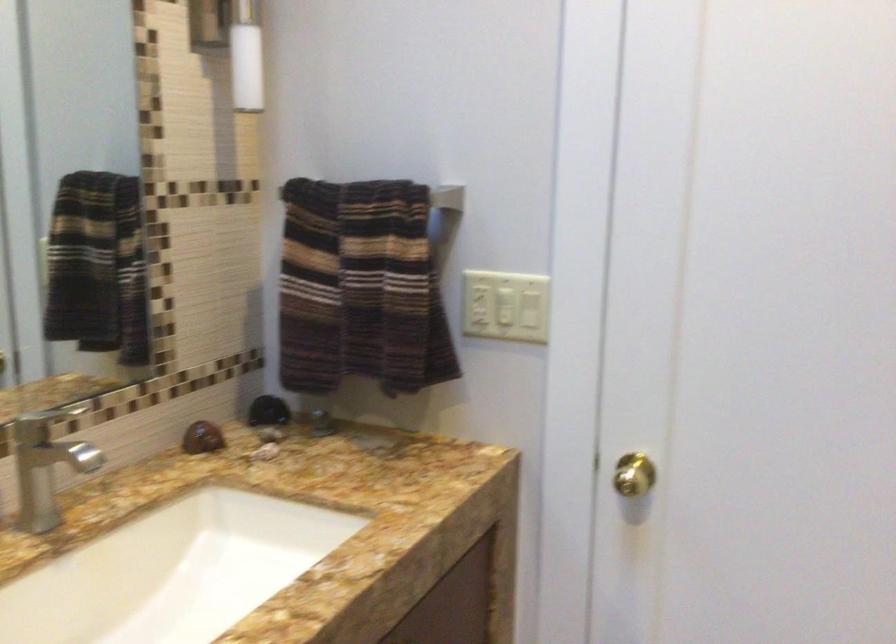
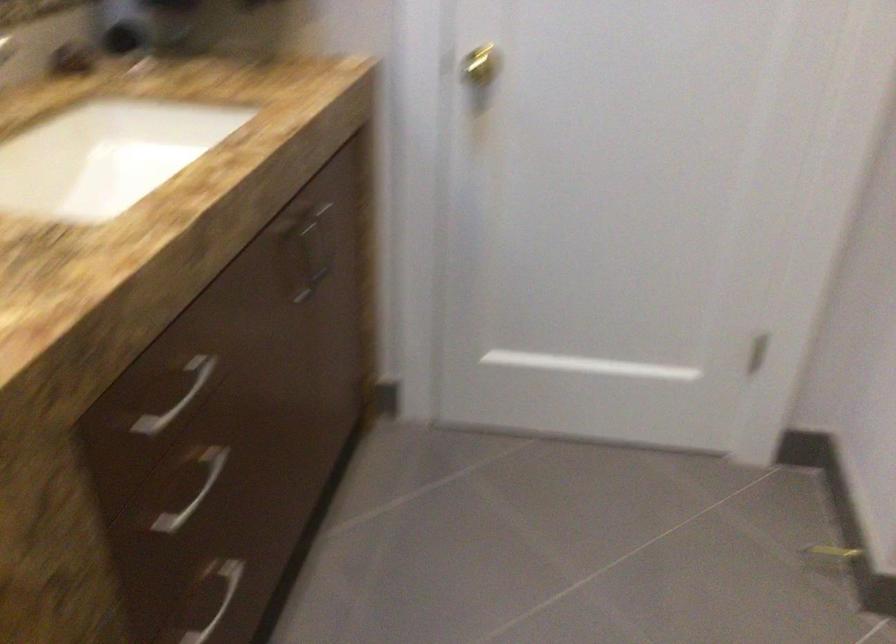
Question: The images are taken continuously from a first-person perspective. In which direction is your viewpoint rotating?

Choices:
 (A) Left
 (B) Right
 (C) Up
 (D) Down

Answer: (D)